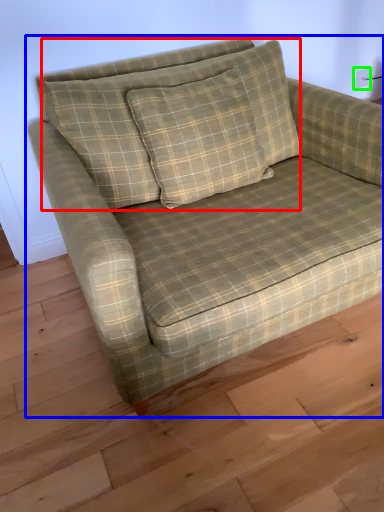
Question: Based on their relative distances, which object is nearer to pillow (highlighted by a red box)? Choose from studio couch (highlighted by a blue box) and electric outlet (highlighted by a green box).

Choices:
 (A) studio couch
 (B) electric outlet

Answer: (A)